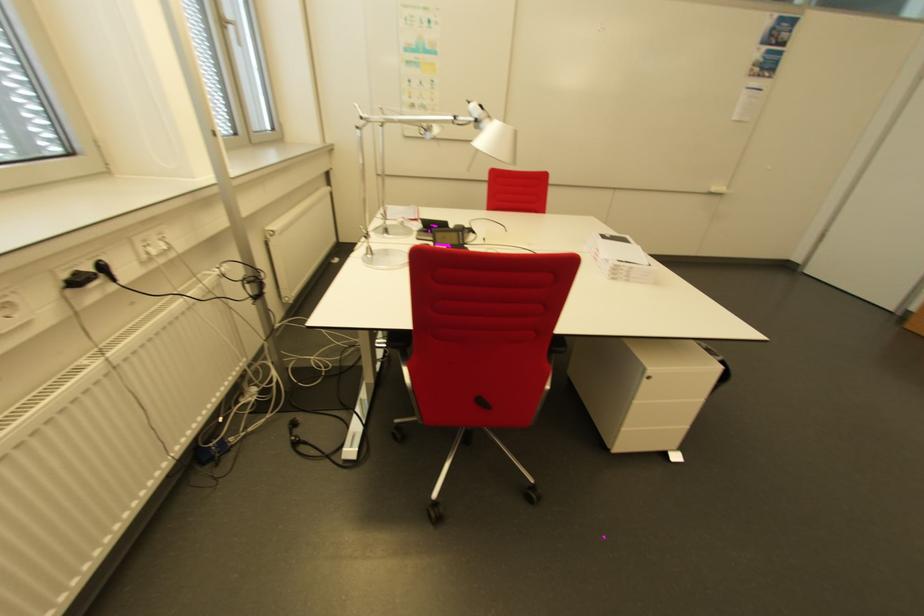
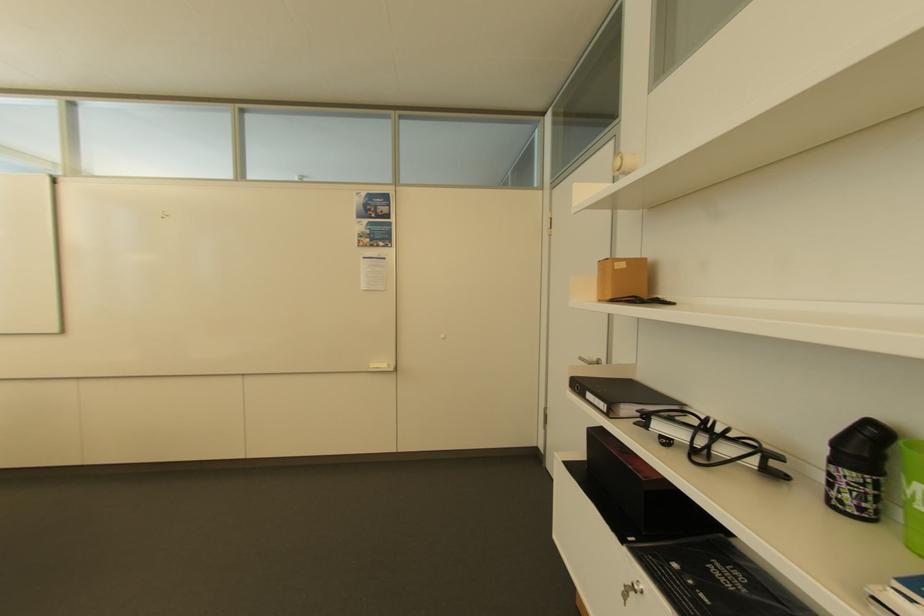
Question: What movement of the cameraman would produce the second image?

Choices:
 (A) Left
 (B) Right
 (C) Forward
 (D) Backward

Answer: (B)